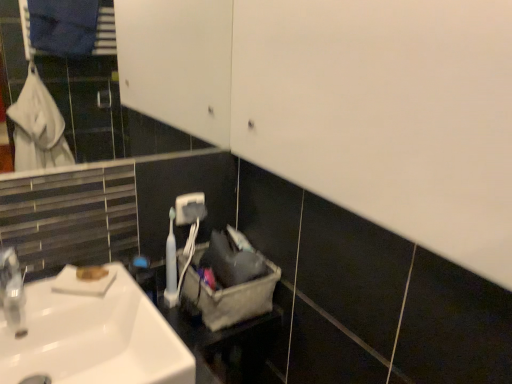
Locate an element on the screen. free point above gray fabric laundry basket at center (from a real-world perspective) is located at coordinates (215, 253).